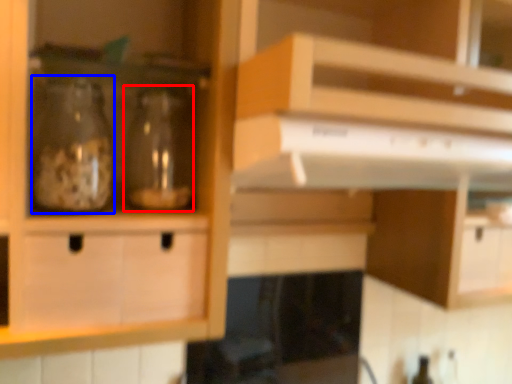
Question: Which object appears farthest to the camera in this image, glass bottle (highlighted by a red box) or glass bottle (highlighted by a blue box)?

Choices:
 (A) glass bottle
 (B) glass bottle

Answer: (A)